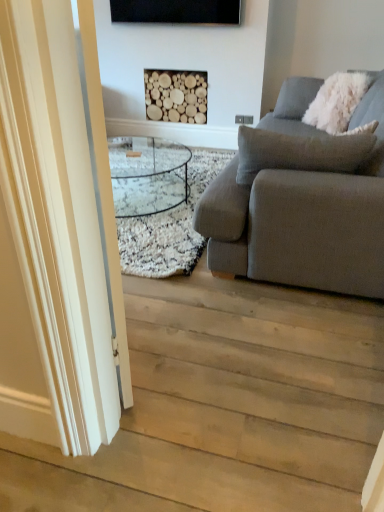
At what (x,y) coordinates should I click in order to perform the action: click on empty space that is ontop of natural wood logs at upper center. Please return your answer as a coordinate pair (x, y). Image resolution: width=384 pixels, height=512 pixels. Looking at the image, I should click on (172, 69).